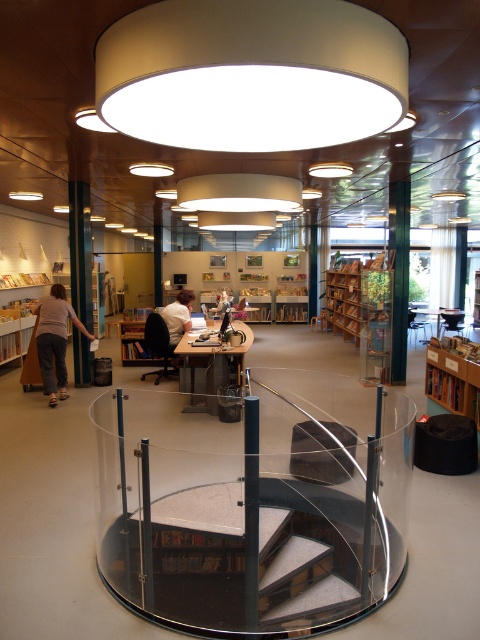
You are standing in the library and want to reach a book located at point (239, 376). The book is on a shelf that is 1.5 meters tall. If you are 1.7 meters tall, can you reach the book without any assistance?

The point (239, 376) is 7.09 meters away from you. Since the shelf is 1.5 meters tall and you are 1.7 meters tall, you can reach the book without assistance as your height exceeds the shelf height.